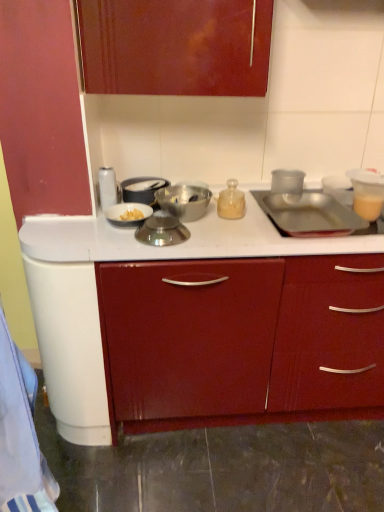
Find the location of a particular element. Image resolution: width=384 pixels, height=512 pixels. empty space that is ontop of metallic bowl at center, the 3th kitchen appliance viewed from the right (from a real-world perspective) is located at coordinates (188, 188).